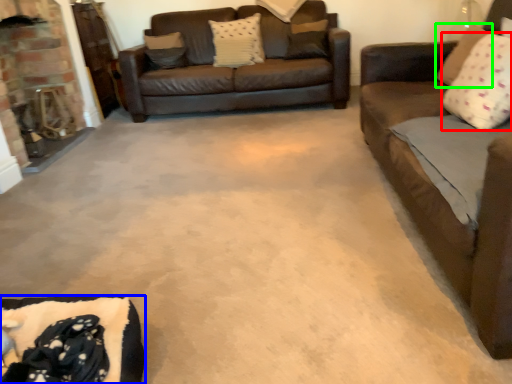
Question: Which object is the farthest from pillow (highlighted by a red box)? Choose among these: couch (highlighted by a blue box) or pillow (highlighted by a green box).

Choices:
 (A) couch
 (B) pillow

Answer: (A)